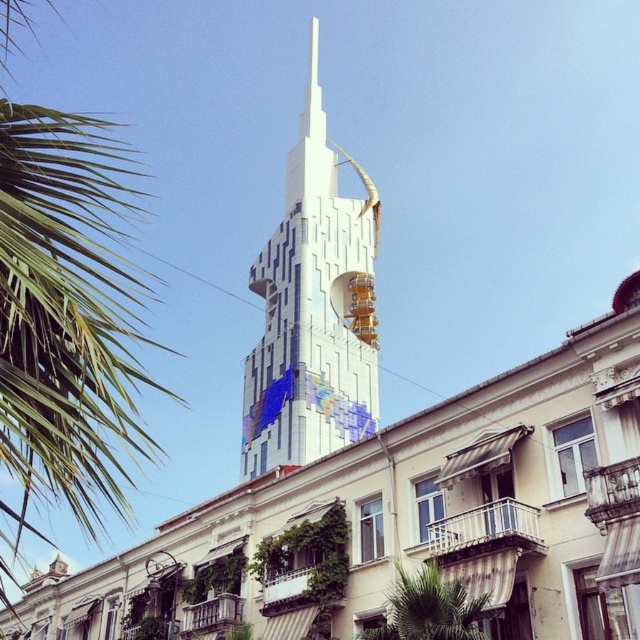
You are a drone operator who needs to fly a drone from the green leafy palm tree at upper left to the white glossy bell tower at center. According to the scene, which direction should you fly the drone to reach the tower?

The green leafy palm tree at upper left is positioned on the left side of the white glossy bell tower at center, so you should fly the drone to the right to reach the tower.

You are standing at the point marked as point (45, 230) and want to reach the entrance of the modern tower in the background. The path is straight and unobstructed. If you walk at a constant speed of 1.2 meters per second, how many seconds will it take you to reach the entrance?

The distance between point (45, 230) and the viewer is 12.96 meters. Since you are starting at point (45, 230), the distance to the entrance is 12.96 meters. At a speed of 1.2 meters per second, the time required is 12.96 divided by 1.2, which equals 10.8 seconds.

You are standing at the base of the white glossy bell tower at center and want to take a photo of it with your camera. The camera is 46.46 meters away from the tower. Based on the scene description, is the camera positioned in the foreground or background of the image?

The camera is positioned in the background of the image because it is 46.46 meters away from the white glossy bell tower at center, which is a significant distance, placing it further back in the scene.